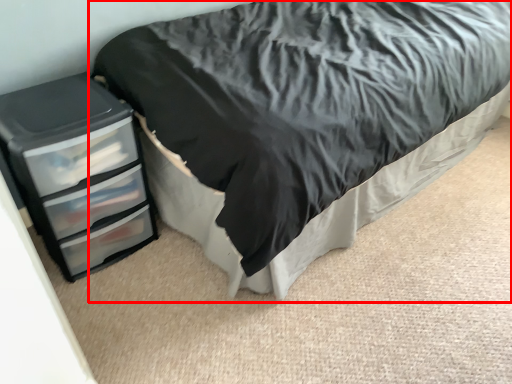
Question: From the image's perspective, what is the correct spatial relationship of bed (annotated by the red box) in relation to chest of drawers?

Choices:
 (A) below
 (B) above

Answer: (B)